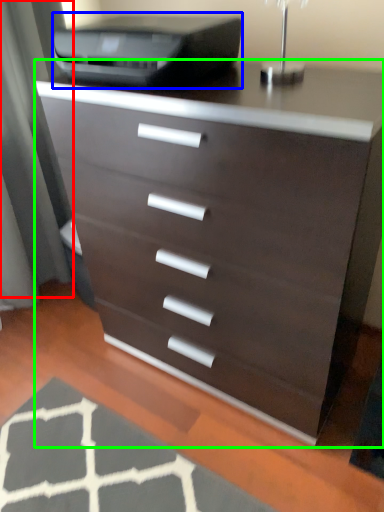
Question: Considering the real-world distances, which object is closest to screen door (highlighted by a red box)? printer (highlighted by a blue box) or chest of drawers (highlighted by a green box).

Choices:
 (A) printer
 (B) chest of drawers

Answer: (A)